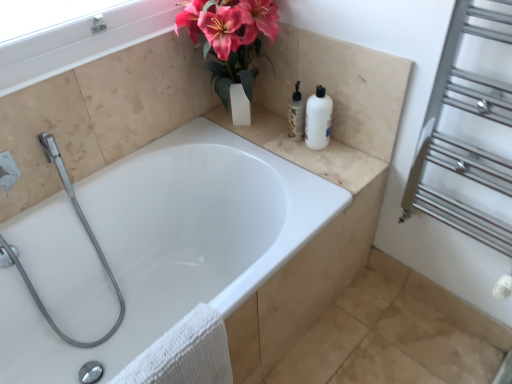
Locate an element on the screen. free point in front of white glossy bottle at upper center is located at coordinates (310, 158).